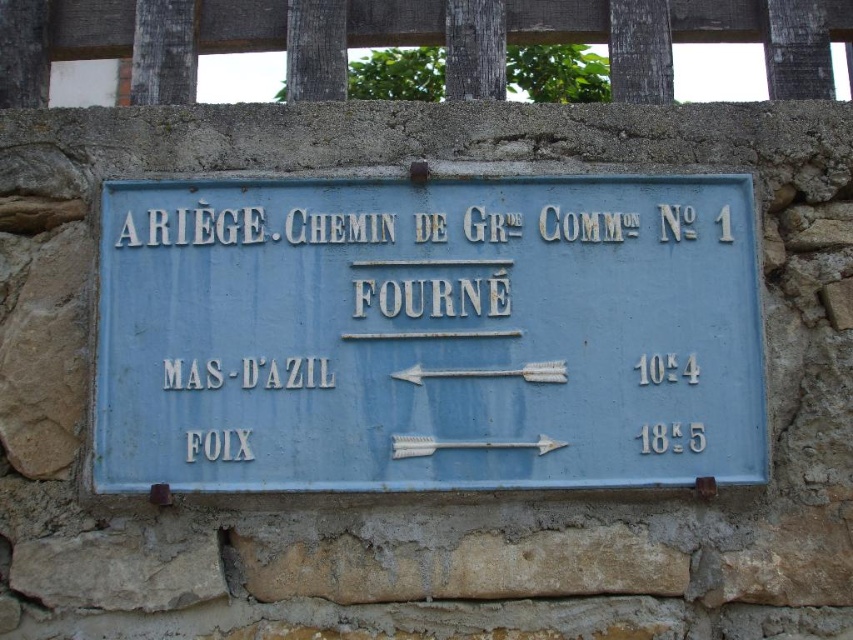
Question: Does white metallic arrow at center have a larger size compared to metallic silver arrow at center?

Choices:
 (A) yes
 (B) no

Answer: (B)

Question: Is blue painted metal sign at center to the left of wooden slats at upper center from the viewer's perspective?

Choices:
 (A) yes
 (B) no

Answer: (A)

Question: Can you confirm if blue painted metal sign at center is positioned to the right of white metallic arrow at center?

Choices:
 (A) yes
 (B) no

Answer: (B)

Question: Which object appears closest to the camera in this image?

Choices:
 (A) white metallic arrow at center
 (B) wooden slats at upper center

Answer: (A)

Question: Among these objects, which one is nearest to the camera?

Choices:
 (A) blue painted metal sign at center
 (B) white metallic arrow at center
 (C) metallic silver arrow at center
 (D) wooden slats at upper center

Answer: (C)

Question: Which of the following is the farthest from the observer?

Choices:
 (A) wooden slats at upper center
 (B) blue painted metal sign at center
 (C) metallic silver arrow at center

Answer: (A)